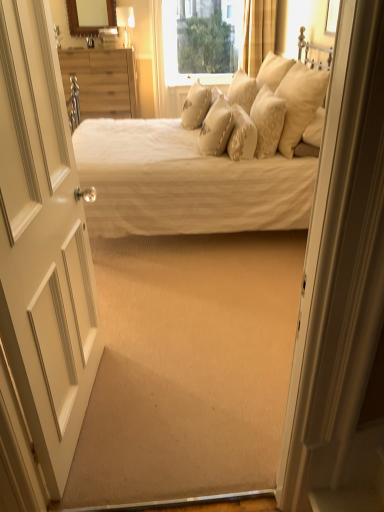
Question: In terms of height, does white wood door at left look taller or shorter compared to creamy satin pillow at upper center, which is counted as the 6th pillow, starting from the right?

Choices:
 (A) short
 (B) tall

Answer: (B)

Question: Based on their sizes in the image, would you say white wood door at left is bigger or smaller than creamy satin pillow at upper center, which ranks as the 1th pillow in left-to-right order?

Choices:
 (A) big
 (B) small

Answer: (A)

Question: Which of these objects is positioned closest to the creamy beige fabric pillow at center, which is the 3th pillow from left to right?

Choices:
 (A) clear glass window at upper center
 (B) yellow textured curtain at upper center
 (C) beige textured pillow at center, placed as the 5th pillow when sorted from right to left
 (D) wooden framed mirror at upper center
 (E) matte gold lampshade at upper center

Answer: (C)

Question: Based on their relative distances, which object is nearer to the creamy satin pillows at upper center, which is the 5th pillow from left to right?

Choices:
 (A) white wood door at left
 (B) wooden dresser at left
 (C) fluffy beige pillow at upper center, acting as the third pillow starting from the right
 (D) clear glass window at upper center
 (E) beige textured pillow at center, the second pillow when ordered from left to right

Answer: (E)